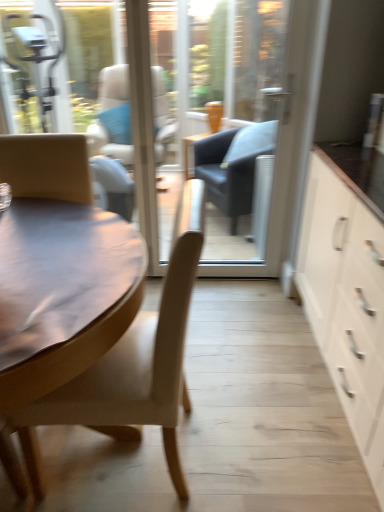
Question: From the image's perspective, does transparent glass door at center appear lower than matte brown chair at left?

Choices:
 (A) no
 (B) yes

Answer: (A)

Question: Is transparent glass door at center oriented towards matte brown chair at left?

Choices:
 (A) yes
 (B) no

Answer: (A)

Question: Can you confirm if transparent glass door at center is taller than matte brown chair at left?

Choices:
 (A) yes
 (B) no

Answer: (A)

Question: Does transparent glass door at center appear on the right side of matte brown chair at left?

Choices:
 (A) no
 (B) yes

Answer: (B)

Question: From the image's perspective, does transparent glass door at center appear higher than matte brown chair at left?

Choices:
 (A) no
 (B) yes

Answer: (B)

Question: Is white matte cabinet at right in front of or behind transparent glass door at center in the image?

Choices:
 (A) front
 (B) behind

Answer: (A)

Question: Is point (354, 204) positioned closer to the camera than point (192, 15)?

Choices:
 (A) closer
 (B) farther

Answer: (A)

Question: In terms of size, does white matte cabinet at right appear bigger or smaller than transparent glass door at center?

Choices:
 (A) big
 (B) small

Answer: (A)

Question: Would you say white matte cabinet at right is inside or outside transparent glass door at center?

Choices:
 (A) inside
 (B) outside

Answer: (B)

Question: Based on their positions, is matte brown chair at left located to the left or right of transparent glass door at center?

Choices:
 (A) right
 (B) left

Answer: (B)

Question: Is matte brown chair at left situated inside transparent glass door at center or outside?

Choices:
 (A) inside
 (B) outside

Answer: (B)

Question: Looking at their shapes, would you say matte brown chair at left is wider or thinner than transparent glass door at center?

Choices:
 (A) thin
 (B) wide

Answer: (B)

Question: Is point (142, 415) closer or farther from the camera than point (218, 135)?

Choices:
 (A) farther
 (B) closer

Answer: (B)

Question: Which is correct: white matte cabinet at right is inside matte brown chair at left, or outside of it?

Choices:
 (A) outside
 (B) inside

Answer: (A)

Question: Based on their positions, is white matte cabinet at right located to the left or right of matte brown chair at left?

Choices:
 (A) left
 (B) right

Answer: (B)